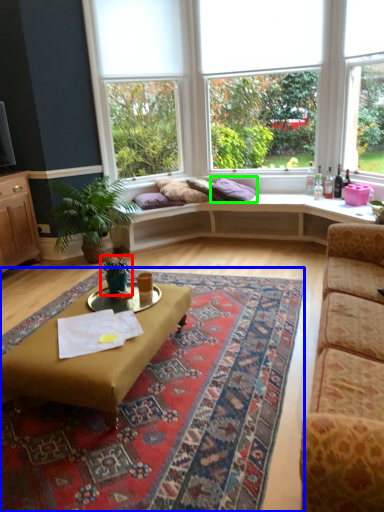
Question: Which is farther away from houseplant (highlighted by a red box)? mat (highlighted by a blue box) or pillow (highlighted by a green box)?

Choices:
 (A) mat
 (B) pillow

Answer: (B)